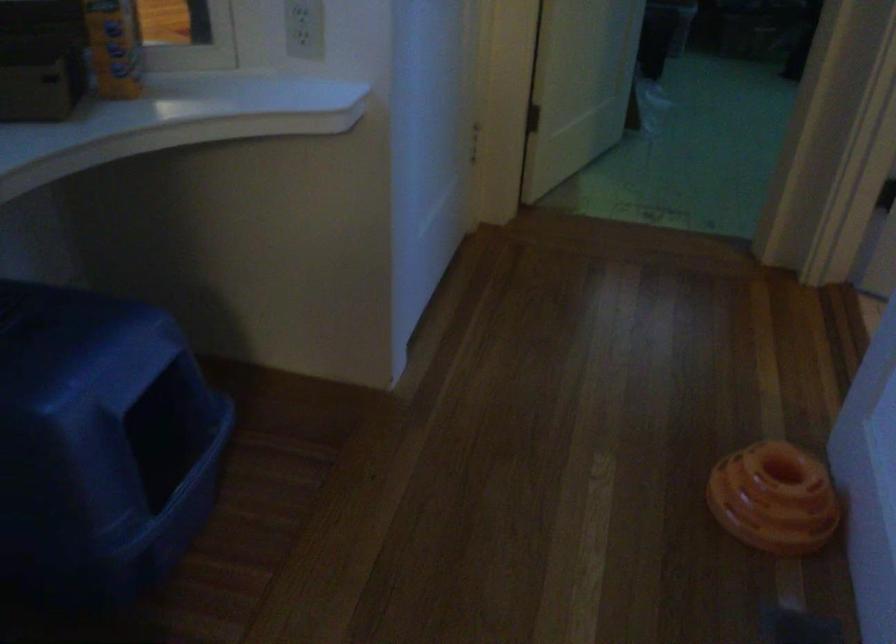
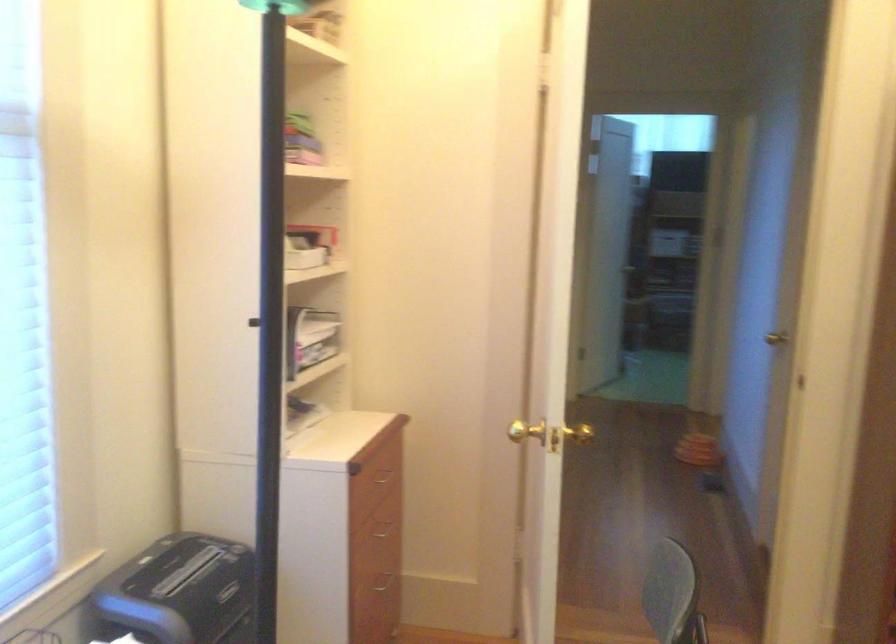
Question: I am providing you with two images of the same scene from different viewpoints. Please identify which objects are invisible in image2.

Choices:
 (A) gold door knob
 (B) red-capped board marker
 (C) litter box cover
 (D) drawer handle

Answer: (C)